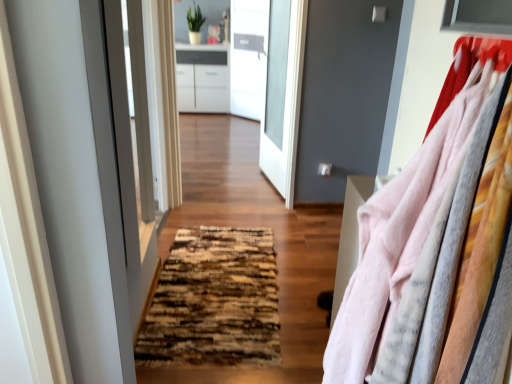
Locate an element on the screen. matte white screen door at center is located at coordinates (122, 160).

Describe the element at coordinates (287, 109) in the screenshot. I see `white glossy cabinet at upper center` at that location.

This screenshot has width=512, height=384. Identify the location of fluffy pink sweater at right. (392, 232).

At what (x,y) coordinates should I click in order to perform the action: click on matte white screen door at center. Please return your answer as a coordinate pair (x, y). This screenshot has width=512, height=384. Looking at the image, I should click on (122, 160).

How far apart are white glossy cabinet at upper center and brown textured rug at center?

A distance of 1.18 meters exists between white glossy cabinet at upper center and brown textured rug at center.

Can brown textured rug at center be found inside white glossy cabinet at upper center?

Definitely not — brown textured rug at center is not inside white glossy cabinet at upper center.

Is white glossy cabinet at upper center bigger than brown textured rug at center?

Correct, white glossy cabinet at upper center is larger in size than brown textured rug at center.

Considering the positions of points (293, 152) and (263, 345), is point (293, 152) farther from camera compared to point (263, 345)?

Yes, point (293, 152) is farther from viewer.

From the image's perspective, is brown textured rug at center positioned above or below transparent glass door at center?

Clearly, from the image's perspective, brown textured rug at center is below transparent glass door at center.

Considering the points (208, 341) and (269, 94), which point is in front, point (208, 341) or point (269, 94)?

The point (208, 341) is closer.

Is brown textured rug at center touching transparent glass door at center?

No, brown textured rug at center is not beside transparent glass door at center.

Does brown textured rug at center have a smaller size compared to transparent glass door at center?

Correct, brown textured rug at center occupies less space than transparent glass door at center.

Based on the photo, are matte white screen door at center and brown textured rug at center located far from each other?

No.

Which is in front, matte white screen door at center or brown textured rug at center?

matte white screen door at center.

Is matte white screen door at center aimed at brown textured rug at center?

No, matte white screen door at center is not aimed at brown textured rug at center.

The width and height of the screenshot is (512, 384). I want to click on mat behind the matte white screen door at center, so click(x=214, y=300).

Between fluffy pink sweater at right and white glossy cabinet at upper center, which one has smaller size?

fluffy pink sweater at right is smaller.

From the image's perspective, is fluffy pink sweater at right above white glossy cabinet at upper center?

No, from the image's perspective, fluffy pink sweater at right is not above white glossy cabinet at upper center.

From a real-world perspective, is fluffy pink sweater at right physically below white glossy cabinet at upper center?

No, from a real-world perspective, fluffy pink sweater at right is not below white glossy cabinet at upper center.

Is fluffy pink sweater at right closer to the viewer compared to white glossy cabinet at upper center?

Yes, fluffy pink sweater at right is closer to the viewer.

From a real-world perspective, is matte white screen door at center physically located above or below fluffy pink sweater at right?

From a real-world perspective, matte white screen door at center is physically below fluffy pink sweater at right.

Can you confirm if matte white screen door at center is taller than fluffy pink sweater at right?

Yes, matte white screen door at center is taller than fluffy pink sweater at right.

Is matte white screen door at center outside of fluffy pink sweater at right?

Absolutely, matte white screen door at center is external to fluffy pink sweater at right.

Is matte white screen door at center touching fluffy pink sweater at right?

No, matte white screen door at center is not touching fluffy pink sweater at right.

Considering the sizes of objects white glossy cabinet at upper center and transparent glass door at center in the image provided, who is smaller, white glossy cabinet at upper center or transparent glass door at center?

With smaller size is transparent glass door at center.

From a real-world perspective, is white glossy cabinet at upper center physically located above or below transparent glass door at center?

Clearly, from a real-world perspective, white glossy cabinet at upper center is below transparent glass door at center.

Is white glossy cabinet at upper center completely or partially outside of transparent glass door at center?

Yes, white glossy cabinet at upper center is not within transparent glass door at center.

Is white glossy cabinet at upper center positioned far away from transparent glass door at center?

That's not correct — white glossy cabinet at upper center is a little close to transparent glass door at center.

Who is smaller, fluffy pink sweater at right or brown textured rug at center?

Smaller between the two is brown textured rug at center.

From the image's perspective, is fluffy pink sweater at right beneath brown textured rug at center?

Incorrect, from the image's perspective, fluffy pink sweater at right is higher than brown textured rug at center.

Does fluffy pink sweater at right contain brown textured rug at center?

No, brown textured rug at center is not a part of fluffy pink sweater at right.

From a real-world perspective, which is physically below, fluffy pink sweater at right or brown textured rug at center?

brown textured rug at center, from a real-world perspective.

Locate an element on the screen. This screenshot has height=384, width=512. clothing store behind the brown textured rug at center is located at coordinates (287, 109).

The image size is (512, 384). I want to click on door that appears above the brown textured rug at center (from a real-world perspective), so click(279, 93).

Estimate the real-world distances between objects in this image. Which object is closer to matte white screen door at center, transparent glass door at center or fluffy pink sweater at right?

The object closer to matte white screen door at center is fluffy pink sweater at right.

Looking at the image, which one is located further to matte white screen door at center, brown textured rug at center or white glossy cabinet at upper center?

white glossy cabinet at upper center is positioned further to the anchor matte white screen door at center.

Estimate the real-world distances between objects in this image. Which object is further from white glossy cabinet at upper center, fluffy pink sweater at right or matte white screen door at center?

Among the two, fluffy pink sweater at right is located further to white glossy cabinet at upper center.

From the image, which object appears to be nearer to brown textured rug at center, matte white screen door at center or transparent glass door at center?

matte white screen door at center is positioned closer to the anchor brown textured rug at center.

Estimate the real-world distances between objects in this image. Which object is further from fluffy pink sweater at right, transparent glass door at center or white glossy cabinet at upper center?

transparent glass door at center lies further to fluffy pink sweater at right than the other object.

Consider the image. Considering their positions, is transparent glass door at center positioned further to white glossy cabinet at upper center than brown textured rug at center?

brown textured rug at center is further to white glossy cabinet at upper center.

From the image, which object appears to be farther from transparent glass door at center, fluffy pink sweater at right or brown textured rug at center?

fluffy pink sweater at right.

From the image, which object appears to be farther from brown textured rug at center, fluffy pink sweater at right or transparent glass door at center?

transparent glass door at center is further to brown textured rug at center.

Where is `mat between fluffy pink sweater at right and transparent glass door at center along the z-axis`? This screenshot has width=512, height=384. mat between fluffy pink sweater at right and transparent glass door at center along the z-axis is located at coordinates (214, 300).

At what (x,y) coordinates should I click in order to perform the action: click on screen door positioned between fluffy pink sweater at right and brown textured rug at center from near to far. Please return your answer as a coordinate pair (x, y). Looking at the image, I should click on (122, 160).

Locate an element on the screen. mat between fluffy pink sweater at right and white glossy cabinet at upper center along the z-axis is located at coordinates (214, 300).

Find the location of a particular element. The width and height of the screenshot is (512, 384). mat positioned between matte white screen door at center and transparent glass door at center from near to far is located at coordinates (214, 300).